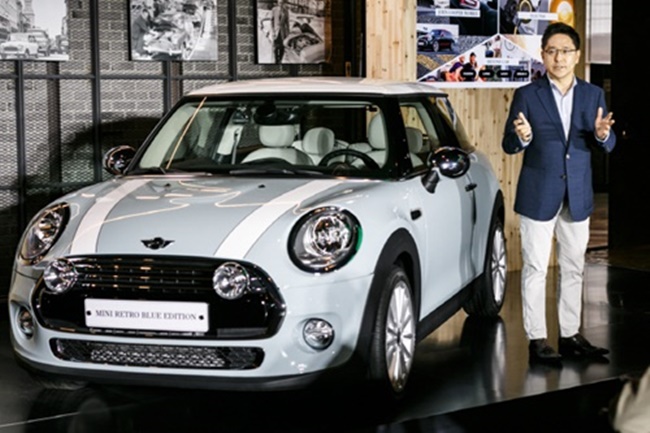
The height and width of the screenshot is (433, 650). I want to click on glossy black floor, so click(x=469, y=393).